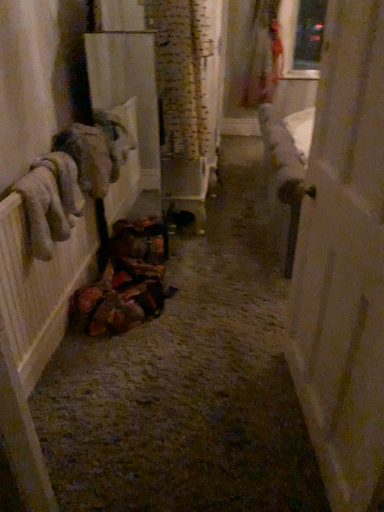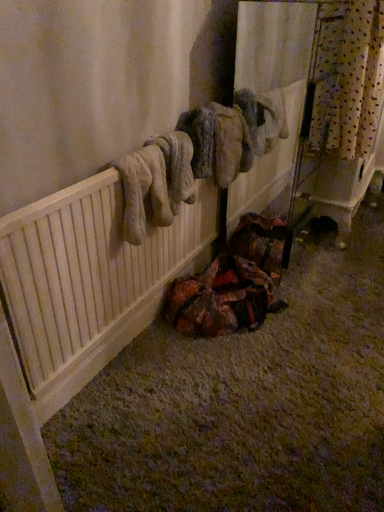
Question: Which way did the camera rotate in the video?

Choices:
 (A) rotated left
 (B) rotated right

Answer: (A)